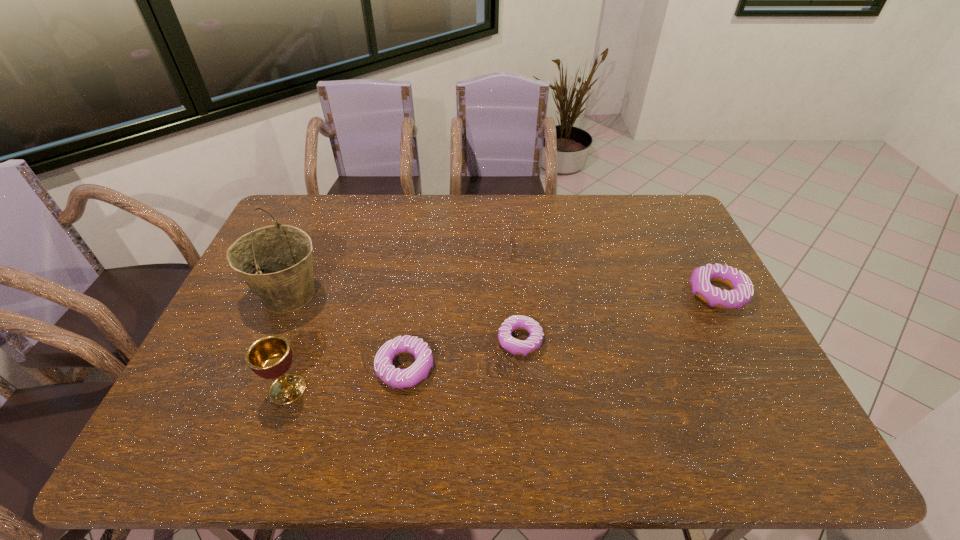
Identify the location of vacant spot for a new doughnut to ensure equal spacing. (624, 316).